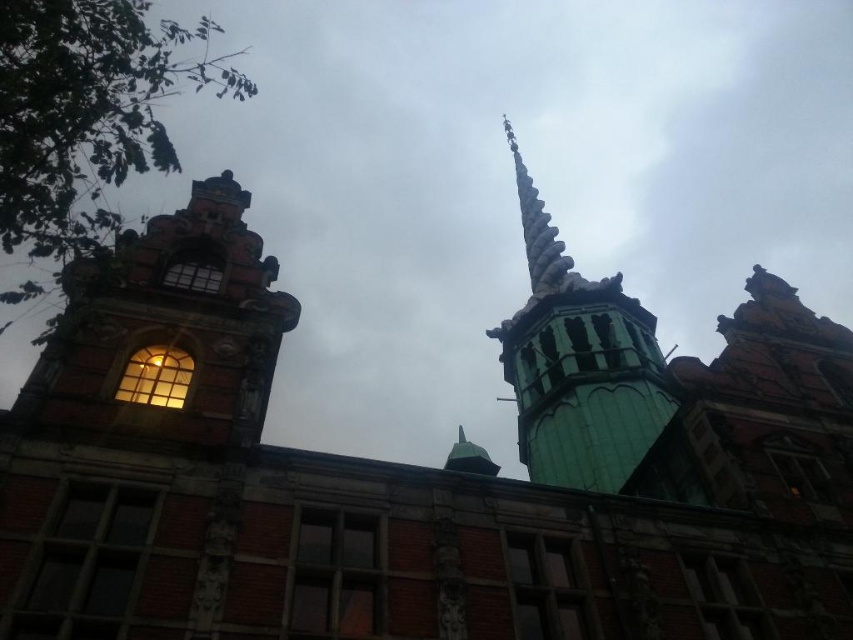
Who is lower down, cloudy sky at upper center or green glazed tile spire at upper center?

Positioned lower is green glazed tile spire at upper center.

Is point (830, 1) positioned after point (549, 248)?

Yes, point (830, 1) is farther from viewer.

Which is behind, point (355, 228) or point (495, 332)?

Point (355, 228)

Locate an element on the screen. The width and height of the screenshot is (853, 640). cloudy sky at upper center is located at coordinates (509, 182).

Can you confirm if green glazed tile spire at upper center is shorter than gray stone spire at upper center?

No, green glazed tile spire at upper center is not shorter than gray stone spire at upper center.

Between point (520, 312) and point (531, 272), which one is positioned behind?

Positioned behind is point (531, 272).

The image size is (853, 640). I want to click on green glazed tile spire at upper center, so click(x=578, y=364).

What do you see at coordinates (509, 182) in the screenshot?
I see `cloudy sky at upper center` at bounding box center [509, 182].

Is point (469, 326) more distant than point (518, 170)?

No, (469, 326) is closer to viewer.

At what (x,y) coordinates should I click in order to perform the action: click on cloudy sky at upper center. Please return your answer as a coordinate pair (x, y). This screenshot has height=640, width=853. Looking at the image, I should click on (509, 182).